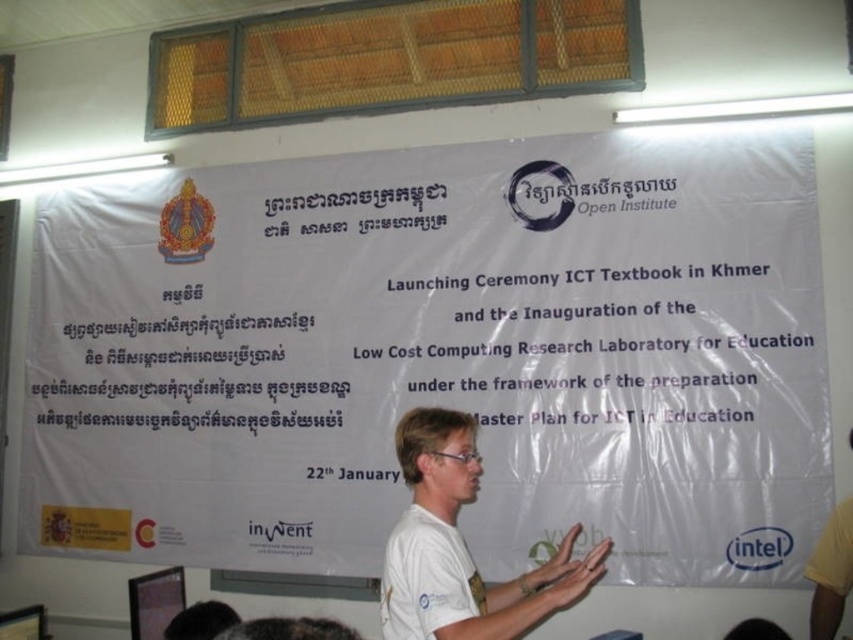
You are a photographer at the event and want to take a photo of the white paper at center and white matte shirt at center. The camera you are using has a maximum focus range of 4 feet. Can you capture both objects in focus without moving the camera or the objects?

The white paper at center and white matte shirt at center are 4.66 feet apart. Since the camera has a maximum focus range of 4 feet, the distance between them exceeds this limit. Therefore, you cannot capture both objects in focus without adjusting the camera or moving the objects.

You are a photographer at the event. You need to take a photo that includes both the white paper at center and the white matte shirt at center. Which object should you focus on first to ensure both are in frame?

You should focus on the white paper at center first because it is larger than the white matte shirt at center, so it will require more space in the frame.